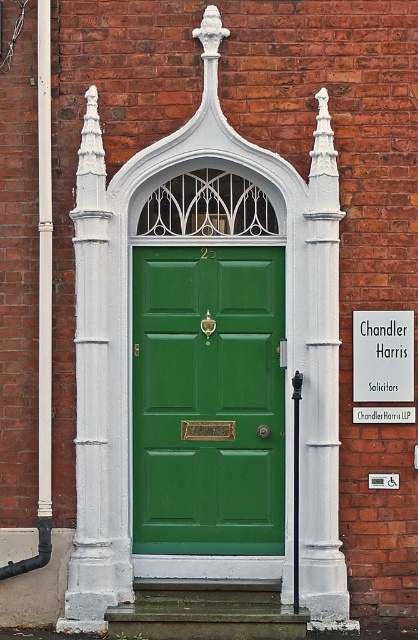
Can you confirm if white painted stone column at left is positioned to the left of white painted stone pillar at center?

Yes, white painted stone column at left is to the left of white painted stone pillar at center.

Who is taller, white painted stone column at left or white painted stone pillar at center?

With more height is white painted stone column at left.

Locate an element on the screen. white painted stone column at left is located at coordinates (94, 403).

Can you confirm if green matte door at center is smaller than white painted stone pillar at center?

No.

You are a GUI agent. You are given a task and a screenshot of the screen. Output one action in this format:
    pyautogui.click(x=<x>, y=<y>)
    Task: Click on the green matte door at center
    
    Given the screenshot: What is the action you would take?
    pyautogui.click(x=208, y=400)

What do you see at coordinates (208, 400) in the screenshot?
I see `green matte door at center` at bounding box center [208, 400].

Does point (165, 547) lie in front of point (101, 326)?

No, (165, 547) is behind (101, 326).

Does point (262, 470) come farther from viewer compared to point (89, 566)?

Yes, point (262, 470) is behind point (89, 566).

Image resolution: width=418 pixels, height=640 pixels. I want to click on green matte door at center, so click(x=208, y=400).